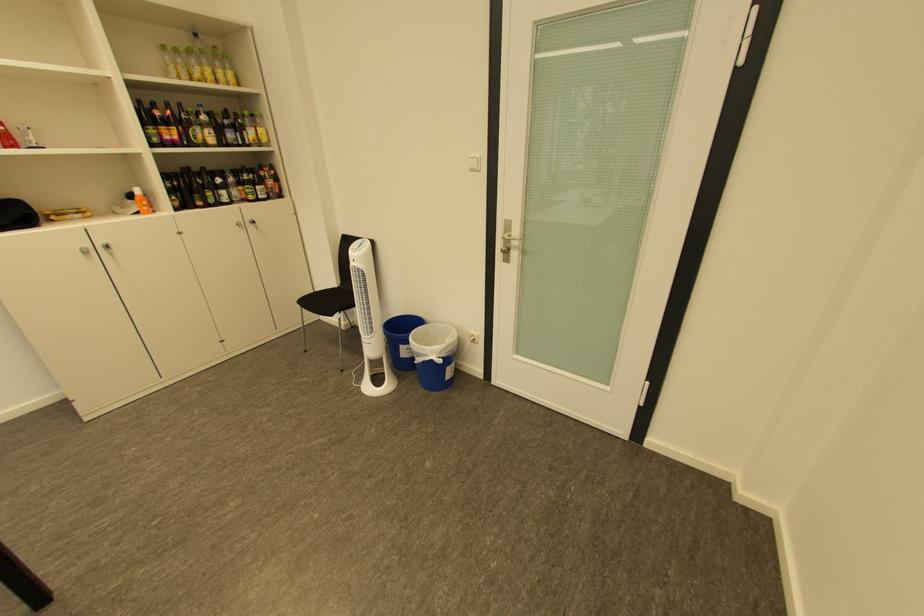
Find where to lift the yellow rectangular box. Please return your answer as a coordinate pair (x, y).

(66, 214)